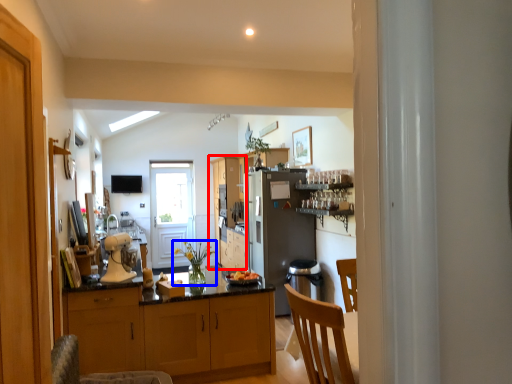
Question: Which object is closer to the camera taking this photo, cabinetry (highlighted by a red box) or houseplant (highlighted by a blue box)?

Choices:
 (A) cabinetry
 (B) houseplant

Answer: (B)